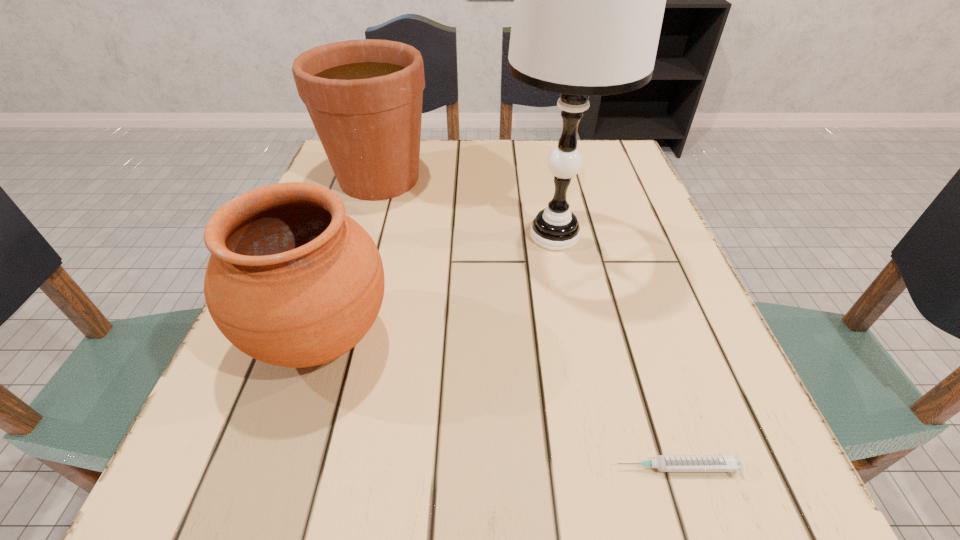
Locate an element on the screen. This screenshot has width=960, height=540. vacant point located at the needle end of the syringe is located at coordinates (568, 468).

The height and width of the screenshot is (540, 960). Find the location of `object that is at the far edge`. object that is at the far edge is located at coordinates (364, 97).

I want to click on object that is at the near edge, so click(x=732, y=463).

At what (x,y) coordinates should I click in order to perform the action: click on flowerpot at the left edge. Please return your answer as a coordinate pair (x, y). The height and width of the screenshot is (540, 960). Looking at the image, I should click on 364,97.

This screenshot has width=960, height=540. In order to click on pottery present at the left edge in this screenshot , I will do `click(292, 281)`.

You are a GUI agent. You are given a task and a screenshot of the screen. Output one action in this format:
    pyautogui.click(x=<x>, y=<y>)
    Task: Click on the table lamp that is at the right edge
    
    Given the screenshot: What is the action you would take?
    pyautogui.click(x=589, y=0)

What are the coordinates of `syringe that is positioned at the right edge` in the screenshot? It's located at (732, 463).

This screenshot has width=960, height=540. I want to click on object present at the far left corner, so click(x=364, y=97).

Locate an element on the screen. object that is at the near right corner is located at coordinates 732,463.

In the image, there is a desktop. Where is `vacant space at the far edge`? This screenshot has width=960, height=540. vacant space at the far edge is located at coordinates (462, 140).